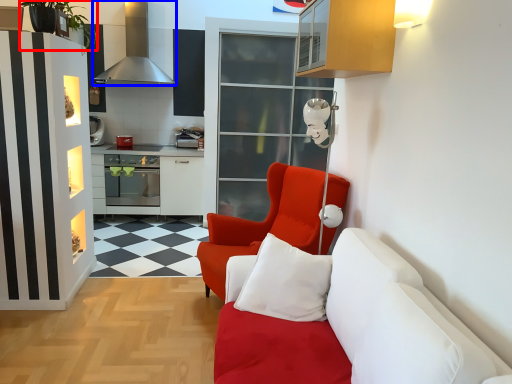
Question: Which of the following is the farthest to the observer, plant (highlighted by a red box) or exhaust hood (highlighted by a blue box)?

Choices:
 (A) plant
 (B) exhaust hood

Answer: (B)